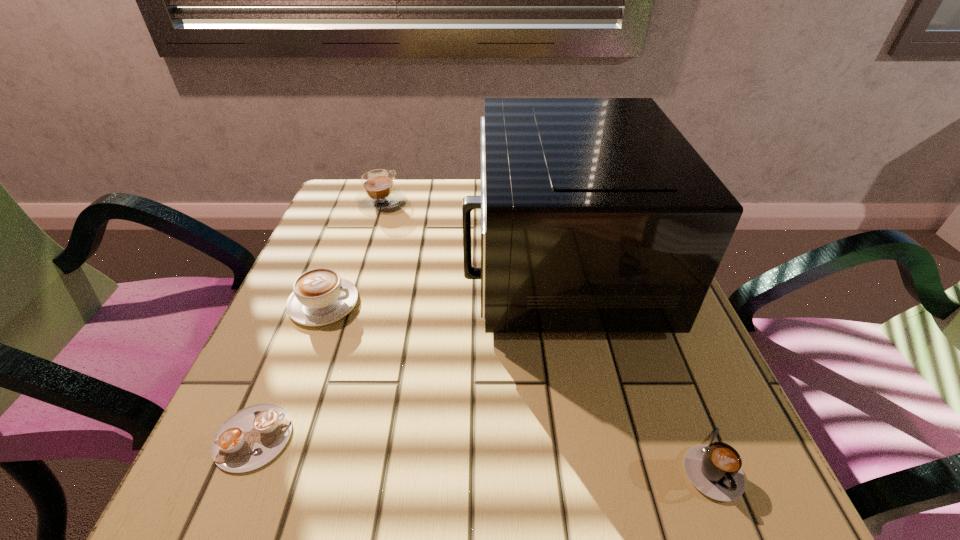
You are a GUI agent. You are given a task and a screenshot of the screen. Output one action in this format:
    pyautogui.click(x=<x>, y=<y>)
    Task: Click on the free spot between the shortest cappuccino and the third shortest cappuccino
    The width and height of the screenshot is (960, 540).
    Given the screenshot: What is the action you would take?
    pyautogui.click(x=289, y=370)

Find the location of a particular element. blank region between the farthest cappuccino and the third tallest object is located at coordinates (352, 252).

Find the location of `vacant point located between the shortest cappuccino and the microwave_oven`. vacant point located between the shortest cappuccino and the microwave_oven is located at coordinates (406, 349).

Where is `the closest object to the microwave_oven`? The height and width of the screenshot is (540, 960). the closest object to the microwave_oven is located at coordinates (379, 193).

Where is `object that is the fourth closest to the microwave_oven`? object that is the fourth closest to the microwave_oven is located at coordinates (252, 437).

Identify the location of cappuccino that stands as the third closest to the farthest cappuccino. The height and width of the screenshot is (540, 960). (715, 470).

I want to click on cappuccino that is the closest to the third shortest object, so click(x=252, y=437).

Find the location of a particular element. The width and height of the screenshot is (960, 540). vacant area that satisfies the following two spatial constraints: 1. on the back side of the shortest object; 2. on the left side of the tallest cappuccino is located at coordinates (351, 201).

Find the location of a particular element. This screenshot has width=960, height=540. free region that satisfies the following two spatial constraints: 1. with the handle on the right side of the second tallest cappuccino; 2. on the front side of the shortest object is located at coordinates [273, 437].